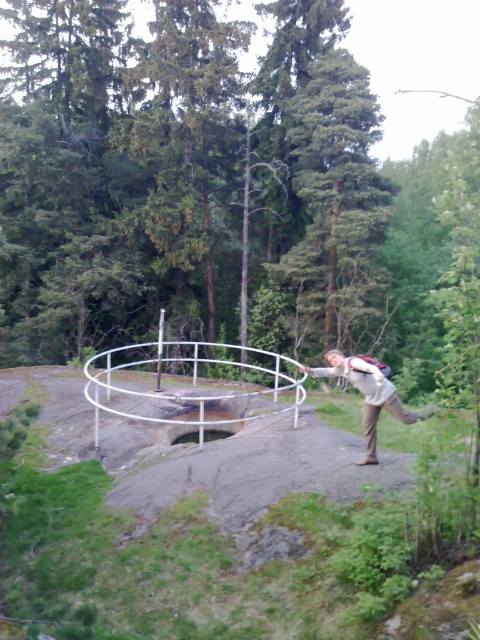
You are a hiker who wants to secure your backpack to the railing using a carabiner. The white metal hula hoop at center and the light beige fabric backpack at center are both in your view. Which object has a larger diameter or width that might be more suitable for attaching the carabiner?

The white metal hula hoop at center has a larger width than the light beige fabric backpack at center, so it would be more suitable for attaching the carabiner.